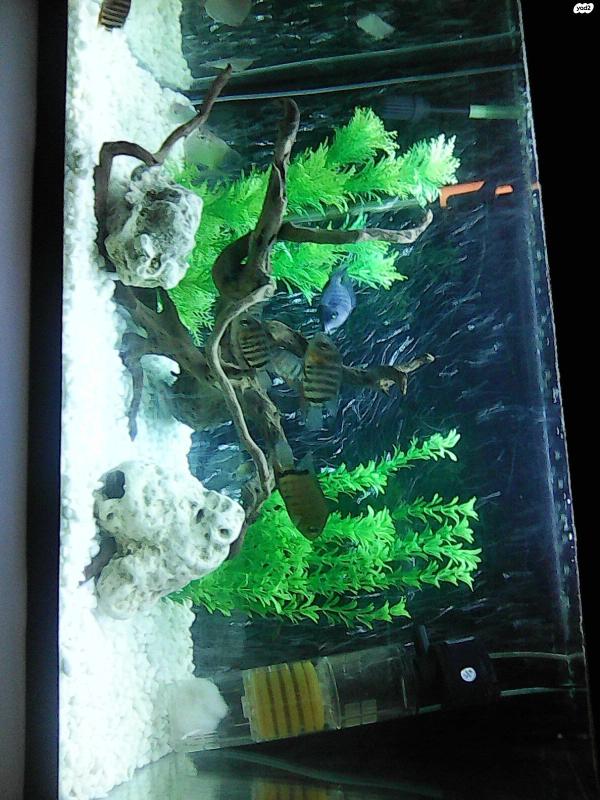
Locate an element on the screen. The width and height of the screenshot is (600, 800). fish tank is located at coordinates (420, 274).